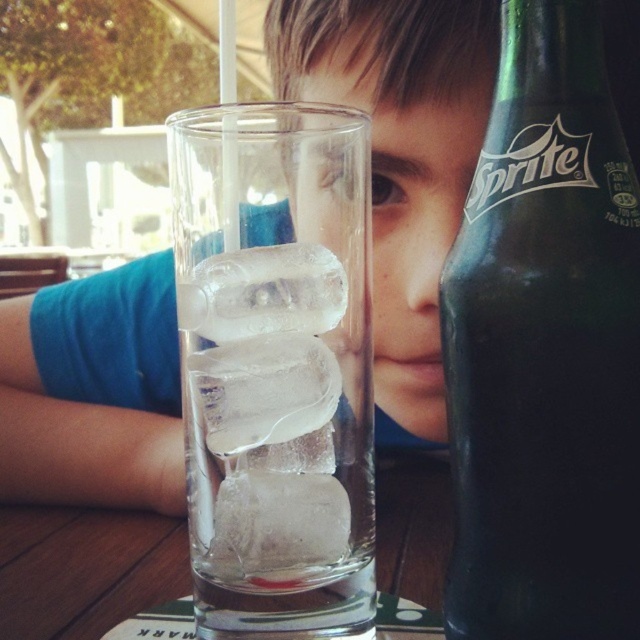
Which is behind, point (536, 186) or point (369, 634)?

Point (369, 634)

Does point (458, 522) come in front of point (289, 448)?

Yes, it is.

Is point (576, 144) farther from camera compared to point (177, 172)?

No.

At what (x,y) coordinates should I click in order to perform the action: click on green glass bottle at right. Please return your answer as a coordinate pair (x, y). Looking at the image, I should click on (545, 348).